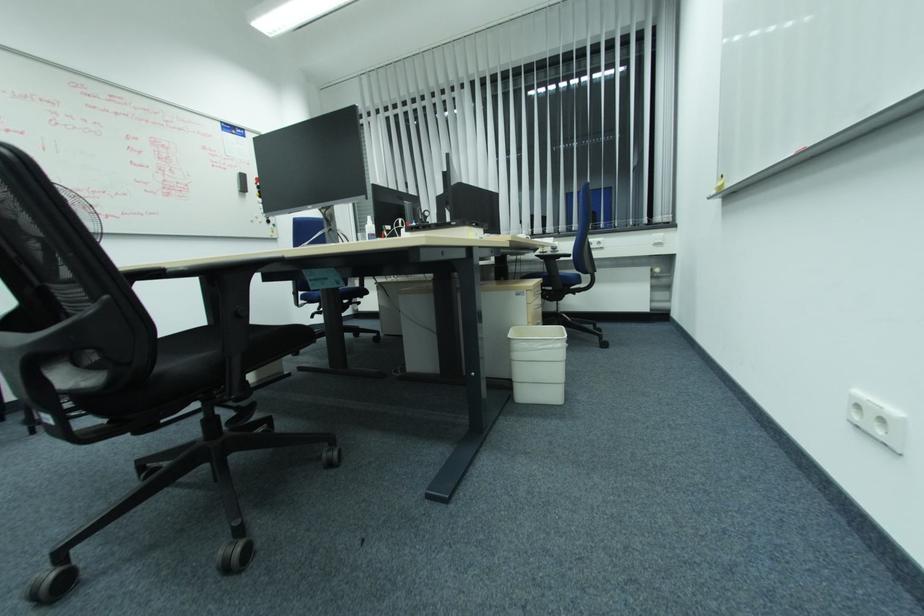
The height and width of the screenshot is (616, 924). I want to click on white power socket, so click(x=878, y=419).